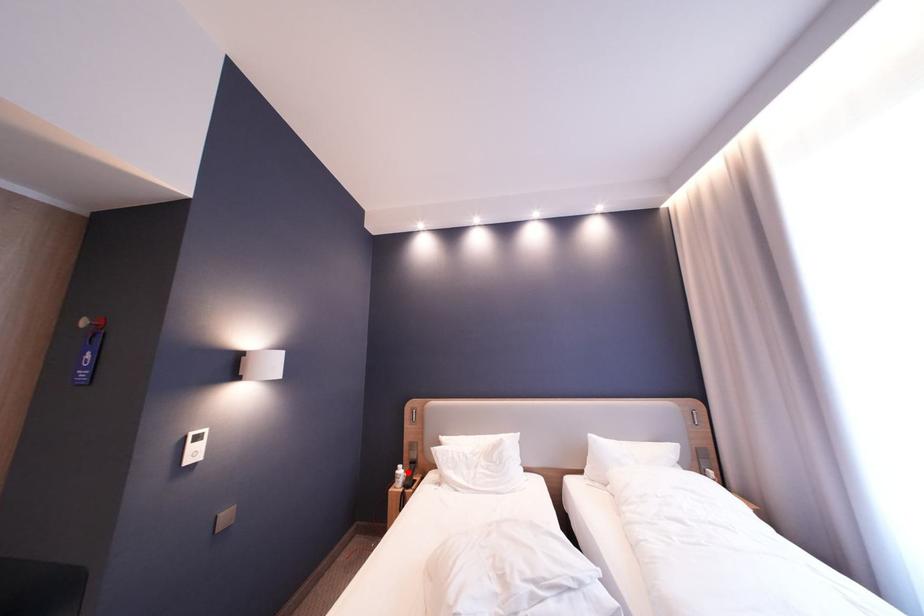
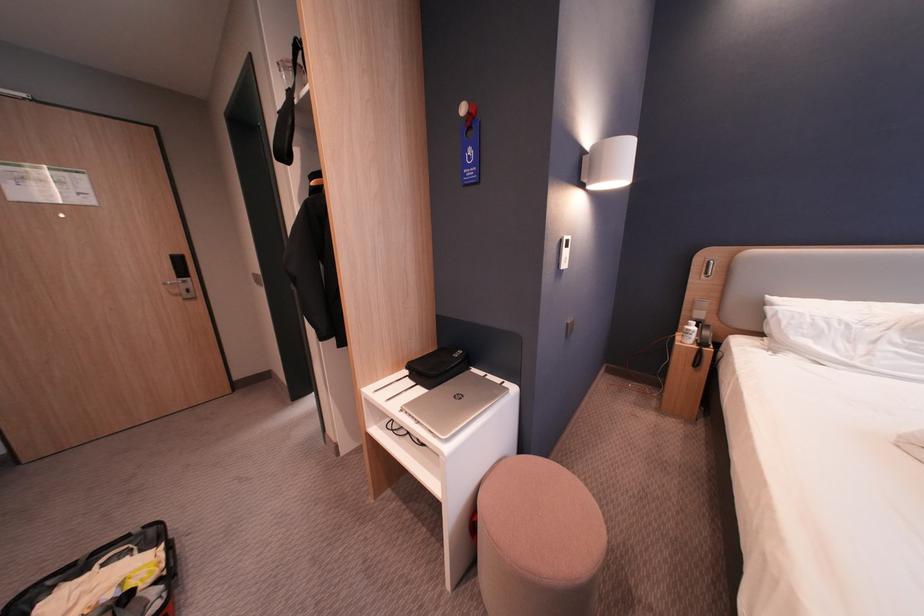
Question: I am providing you with two images of the same scene from different viewpoints. In image1, a red point is highlighted. Considering the same 3D point in image2, which of the following is correct?

Choices:
 (A) It is closer
 (B) It is farther

Answer: (A)